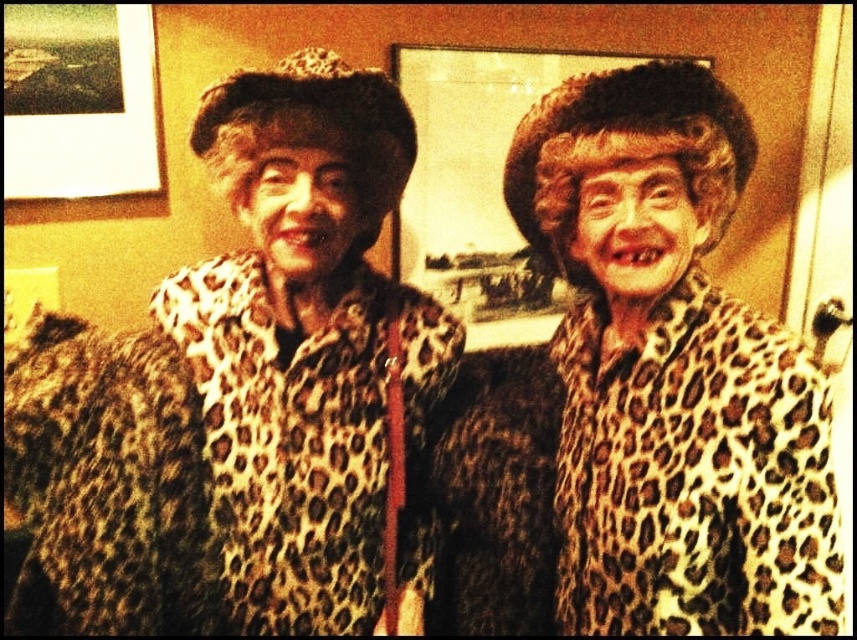
Question: Is leopard print coat at center to the left of matte plastic picture frame at upper center from the viewer's perspective?

Choices:
 (A) yes
 (B) no

Answer: (A)

Question: Which point is farther to the camera?

Choices:
 (A) leopard print coat at center
 (B) leopard print fur coat at center

Answer: (B)

Question: Where is leopard print fur coat at center located in relation to matte plastic picture frame at upper center in the image?

Choices:
 (A) below
 (B) above

Answer: (A)

Question: Does leopard print fur coat at center have a larger size compared to matte plastic picture frame at upper center?

Choices:
 (A) no
 (B) yes

Answer: (A)

Question: Among these objects, which one is farthest from the camera?

Choices:
 (A) leopard print coat at center
 (B) leopard print fur coat at center

Answer: (B)

Question: Which object is farther from the camera taking this photo?

Choices:
 (A) matte plastic picture frame at upper center
 (B) leopard print fur coat at center
 (C) leopard print coat at center

Answer: (A)